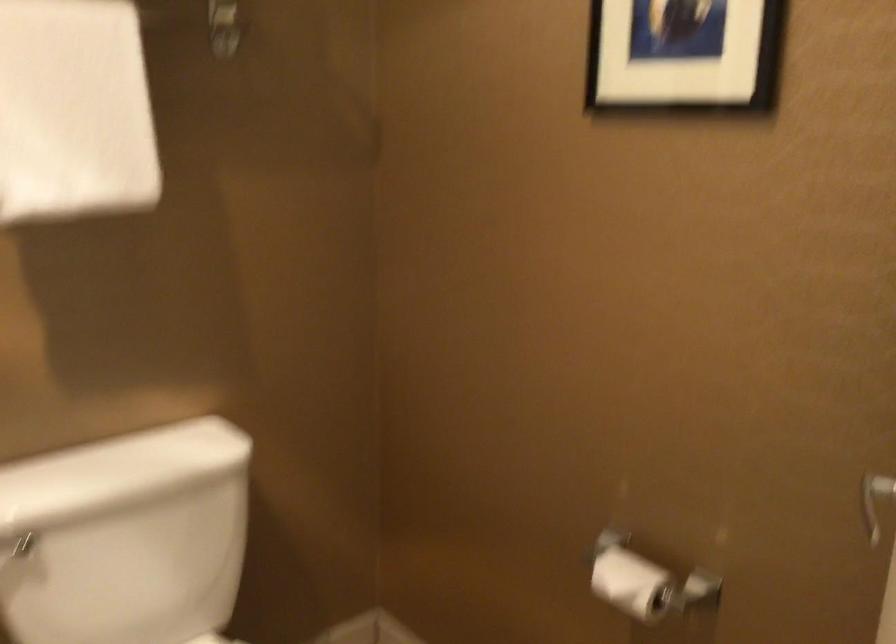
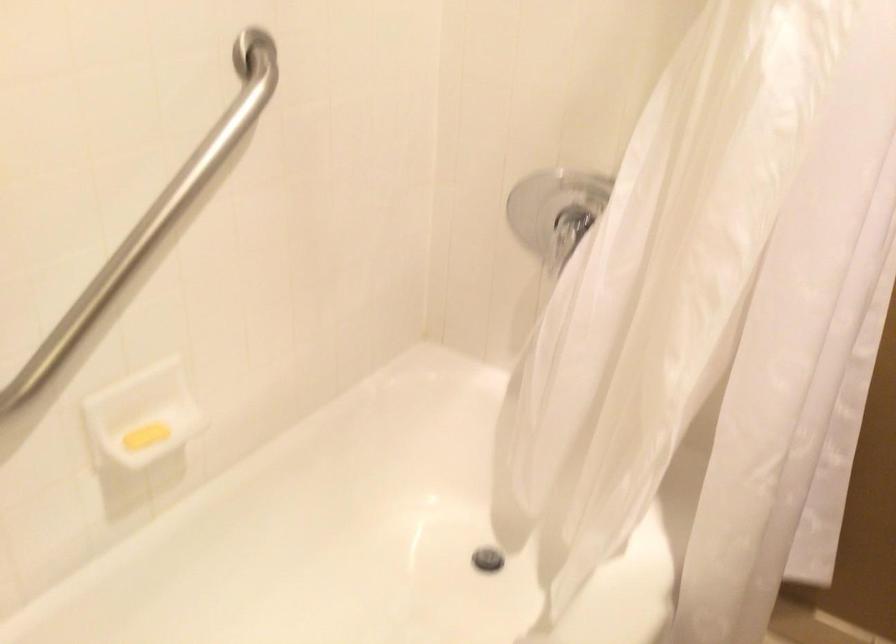
How did the camera likely rotate?

The rotation direction of the camera is left-down.